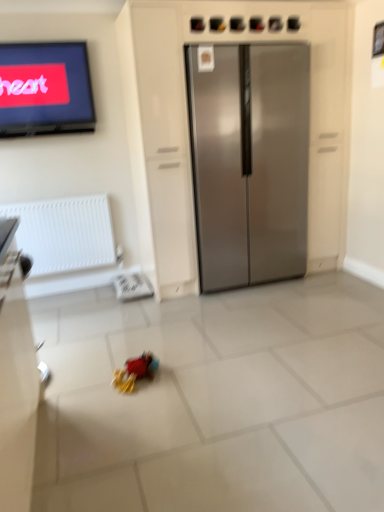
Question: From a real-world perspective, is rubberized plastic toy at center physically located above or below stainless steel refrigerator at center?

Choices:
 (A) below
 (B) above

Answer: (A)

Question: Would you say rubberized plastic toy at center is to the left or to the right of stainless steel refrigerator at center in the picture?

Choices:
 (A) right
 (B) left

Answer: (B)

Question: Estimate the real-world distances between objects in this image. Which object is farther from the white textured radiator at left?

Choices:
 (A) rubberized plastic toy at center
 (B) stainless steel refrigerator at center

Answer: (A)

Question: Which is nearer to the rubberized plastic toy at center?

Choices:
 (A) white textured radiator at left
 (B) stainless steel refrigerator at center

Answer: (A)